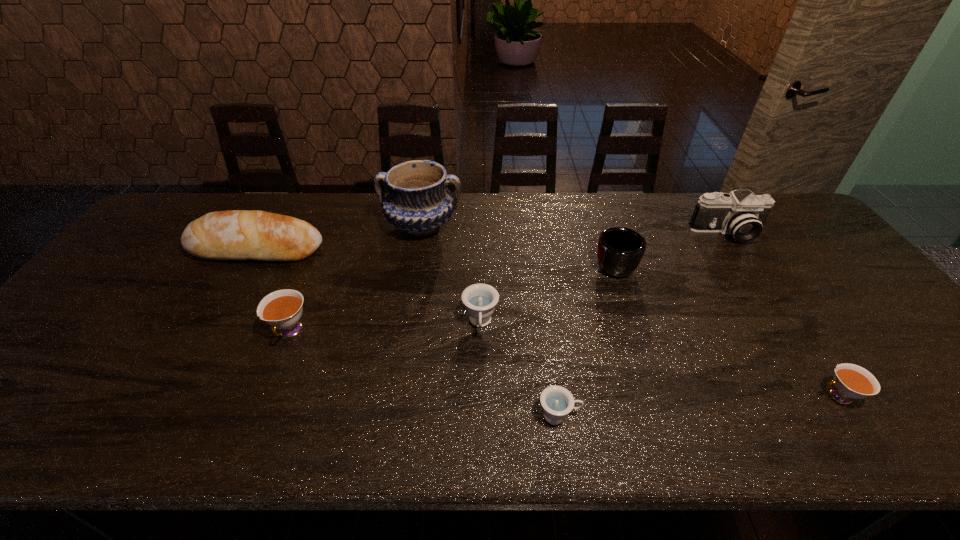
Identify the location of vacant space positioned 0.170m on the side of the sixth object from left to right with the handle. (597, 212).

Where is `vacant space situated on the side of the leftmost teacup with the handle`? The height and width of the screenshot is (540, 960). vacant space situated on the side of the leftmost teacup with the handle is located at coordinates (264, 395).

You are a GUI agent. You are given a task and a screenshot of the screen. Output one action in this format:
    pyautogui.click(x=<x>, y=<y>)
    Task: Click on the vacant space positioned on the side of the bigger blue teacup with the handle
    
    Given the screenshot: What is the action you would take?
    pyautogui.click(x=480, y=400)

Where is `blank space located on the side of the right white teacup with the handle`? This screenshot has width=960, height=540. blank space located on the side of the right white teacup with the handle is located at coordinates (648, 396).

The image size is (960, 540). In order to click on vacant space situated 0.070m on the side of the right white teacup with the handle in this screenshot , I will do `click(785, 396)`.

Where is `blank space located on the side of the right white teacup with the handle`? The height and width of the screenshot is (540, 960). blank space located on the side of the right white teacup with the handle is located at coordinates (661, 396).

Locate an element on the screen. This screenshot has width=960, height=540. free spot located on the side of the nearer blue teacup with the handle is located at coordinates (657, 416).

The width and height of the screenshot is (960, 540). Identify the location of pottery located at the far edge. (418, 202).

Identify the location of camera that is at the far edge. The image size is (960, 540). (741, 213).

You are a GUI agent. You are given a task and a screenshot of the screen. Output one action in this format:
    pyautogui.click(x=<x>, y=<y>)
    Task: Click on the bread located in the far edge section of the desktop
    
    Given the screenshot: What is the action you would take?
    pyautogui.click(x=235, y=234)